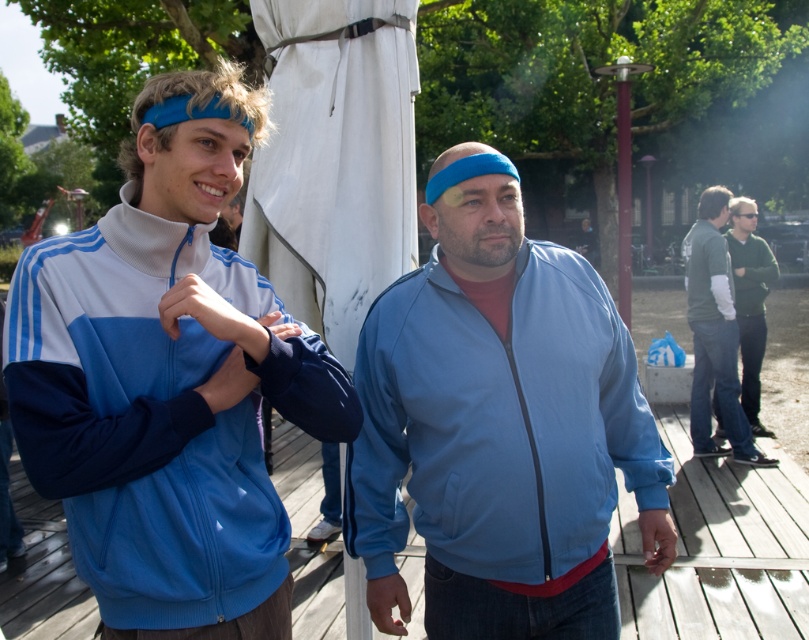
Question: Which object is closer to the camera taking this photo?

Choices:
 (A) blue matte jacket at center
 (B) matte blue track jacket at left

Answer: (B)

Question: Does matte blue track jacket at left appear under blue matte jacket at center?

Choices:
 (A) no
 (B) yes

Answer: (A)

Question: Estimate the real-world distances between objects in this image. Which object is farther from the green sweater at right?

Choices:
 (A) matte blue track jacket at left
 (B) blue matte jacket at center

Answer: (A)

Question: Can you confirm if blue matte jacket at center is positioned to the left of green sweater at right?

Choices:
 (A) no
 (B) yes

Answer: (B)

Question: Can you confirm if matte blue track jacket at left is positioned above green sweater at right?

Choices:
 (A) yes
 (B) no

Answer: (B)

Question: Among these objects, which one is farthest from the camera?

Choices:
 (A) green sweater at right
 (B) blue matte jacket at center
 (C) matte blue track jacket at left

Answer: (A)